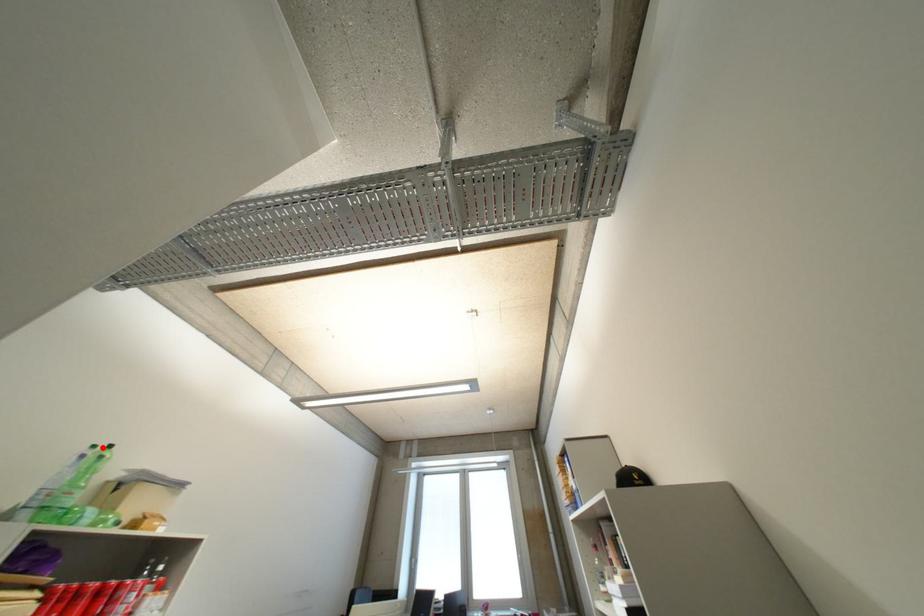
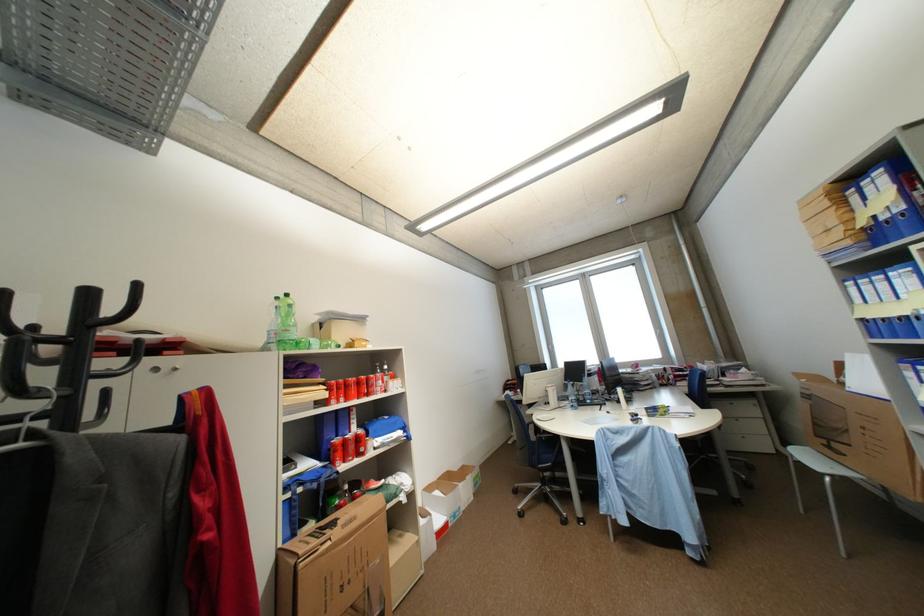
The point at the highlighted location is marked in the first image. Where is the corresponding point in the second image?

(286, 300)